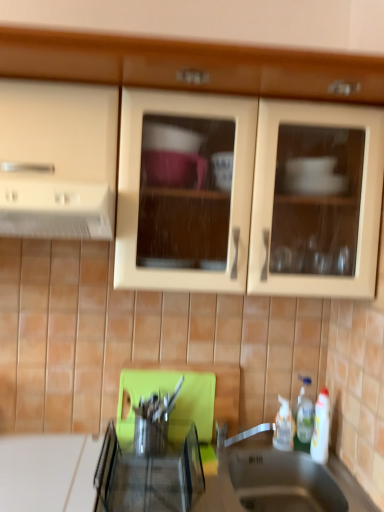
Locate an element on the screen. This screenshot has height=512, width=384. white matte exhaust hood at left is located at coordinates (54, 209).

The height and width of the screenshot is (512, 384). Describe the element at coordinates (54, 209) in the screenshot. I see `white matte exhaust hood at left` at that location.

Where is `metallic stainless steel sink at lower center`? This screenshot has width=384, height=512. metallic stainless steel sink at lower center is located at coordinates (283, 482).

In order to face metallic stainless steel knife block at center, should I rotate leftwards or rightwards?

It's best to rotate left around 5.247 degrees.

Locate an element on the screen. This screenshot has width=384, height=512. metallic stainless steel knife block at center is located at coordinates (148, 477).

Locate an element on the screen. Image resolution: width=384 pixels, height=512 pixels. white glossy bottle at lower right, the 1th bottle positioned from the right is located at coordinates (321, 428).

Identify the location of white matte exhaust hood at left. This screenshot has height=512, width=384. (54, 209).

Considering their positions, is white plastic bottle at lower right, acting as the 1th bottle starting from the left, located in front of or behind metallic stainless steel sink at lower center?

Clearly, white plastic bottle at lower right, acting as the 1th bottle starting from the left, is behind metallic stainless steel sink at lower center.

Would you say white plastic bottle at lower right, acting as the 2th bottle starting from the right, is inside or outside metallic stainless steel sink at lower center?

white plastic bottle at lower right, acting as the 2th bottle starting from the right, exists outside the volume of metallic stainless steel sink at lower center.

Considering the positions of objects white plastic bottle at lower right, acting as the 1th bottle starting from the left, and metallic stainless steel sink at lower center in the image provided, who is more to the right, white plastic bottle at lower right, acting as the 1th bottle starting from the left, or metallic stainless steel sink at lower center?

From the viewer's perspective, white plastic bottle at lower right, acting as the 1th bottle starting from the left, appears more on the right side.

Looking at this image, considering the sizes of objects white plastic bottle at lower right, acting as the 2th bottle starting from the right, and metallic stainless steel sink at lower center in the image provided, who is smaller, white plastic bottle at lower right, acting as the 2th bottle starting from the right, or metallic stainless steel sink at lower center?

With smaller size is white plastic bottle at lower right, acting as the 2th bottle starting from the right.

Does point (3, 230) come closer to viewer compared to point (146, 511)?

No, (3, 230) is further to viewer.

Which of these two, white matte exhaust hood at left or metallic stainless steel knife block at center, is smaller?

Smaller between the two is metallic stainless steel knife block at center.

Is white matte exhaust hood at left wider than metallic stainless steel knife block at center?

Indeed, white matte exhaust hood at left has a greater width compared to metallic stainless steel knife block at center.

Does white matte exhaust hood at left have a greater height compared to metallic stainless steel knife block at center?

Yes, white matte exhaust hood at left is taller than metallic stainless steel knife block at center.

Does white glossy bottle at lower right, the 1th bottle positioned from the right, appear on the right side of matte wood cabinets at upper center?

Correct, you'll find white glossy bottle at lower right, the 1th bottle positioned from the right, to the right of matte wood cabinets at upper center.

From the image's perspective, would you say white glossy bottle at lower right, which is the 2th bottle from left to right, is shown under matte wood cabinets at upper center?

Yes, from the image's perspective, white glossy bottle at lower right, which is the 2th bottle from left to right, is below matte wood cabinets at upper center.

Is white glossy bottle at lower right, the 1th bottle positioned from the right, turned away from matte wood cabinets at upper center?

white glossy bottle at lower right, the 1th bottle positioned from the right, does not have its back to matte wood cabinets at upper center.

Which of these two, white plastic bottle at lower right, acting as the 2th bottle starting from the right, or white glossy bottle at lower right, which is the 2th bottle from left to right, stands shorter?

Standing shorter between the two is white plastic bottle at lower right, acting as the 2th bottle starting from the right.

Considering the positions of objects white plastic bottle at lower right, acting as the 2th bottle starting from the right, and white glossy bottle at lower right, which is the 2th bottle from left to right, in the image provided, who is more to the left, white plastic bottle at lower right, acting as the 2th bottle starting from the right, or white glossy bottle at lower right, which is the 2th bottle from left to right,?

Positioned to the left is white plastic bottle at lower right, acting as the 2th bottle starting from the right.

Is white plastic bottle at lower right, acting as the 2th bottle starting from the right, spatially inside white glossy bottle at lower right, the 1th bottle positioned from the right, or outside of it?

white plastic bottle at lower right, acting as the 2th bottle starting from the right, cannot be found inside white glossy bottle at lower right, the 1th bottle positioned from the right.

Is white plastic bottle at lower right, acting as the 1th bottle starting from the left, positioned far away from white glossy bottle at lower right, which is the 2th bottle from left to right?

No.

Are matte wood cabinets at upper center and white glossy bottle at lower right, the 1th bottle positioned from the right, beside each other?

No, matte wood cabinets at upper center is not beside white glossy bottle at lower right, the 1th bottle positioned from the right.

From the image's perspective, which object appears higher, matte wood cabinets at upper center or white glossy bottle at lower right, the 1th bottle positioned from the right?

matte wood cabinets at upper center appears higher in the image.

Considering the sizes of matte wood cabinets at upper center and white glossy bottle at lower right, which is the 2th bottle from left to right, in the image, is matte wood cabinets at upper center taller or shorter than white glossy bottle at lower right, which is the 2th bottle from left to right,?

matte wood cabinets at upper center is taller than white glossy bottle at lower right, which is the 2th bottle from left to right.

Which object is wider, white glossy bottle at lower right, which is the 2th bottle from left to right, or white matte exhaust hood at left?

white matte exhaust hood at left.

Is white glossy bottle at lower right, the 1th bottle positioned from the right, bigger than white matte exhaust hood at left?

No, white glossy bottle at lower right, the 1th bottle positioned from the right, is not bigger than white matte exhaust hood at left.

Looking at this image, is white glossy bottle at lower right, the 1th bottle positioned from the right, situated inside white matte exhaust hood at left or outside?

white glossy bottle at lower right, the 1th bottle positioned from the right, exists outside the volume of white matte exhaust hood at left.

Who is taller, white glossy bottle at lower right, the 1th bottle positioned from the right, or white matte exhaust hood at left?

With more height is white glossy bottle at lower right, the 1th bottle positioned from the right.

Would you say matte wood cabinets at upper center contains white plastic bottle at lower right, acting as the 1th bottle starting from the left?

No.

Does matte wood cabinets at upper center come behind white plastic bottle at lower right, acting as the 2th bottle starting from the right?

No, it is not.

Considering the sizes of objects matte wood cabinets at upper center and white plastic bottle at lower right, acting as the 2th bottle starting from the right, in the image provided, who is thinner, matte wood cabinets at upper center or white plastic bottle at lower right, acting as the 2th bottle starting from the right,?

Thinner between the two is white plastic bottle at lower right, acting as the 2th bottle starting from the right.

Which is more to the right, matte wood cabinets at upper center or white plastic bottle at lower right, acting as the 1th bottle starting from the left?

white plastic bottle at lower right, acting as the 1th bottle starting from the left, is more to the right.

Locate an element on the screen. the 1st bottle above the metallic stainless steel sink at lower center (from a real-world perspective) is located at coordinates (284, 426).

Locate an element on the screen. The image size is (384, 512). appliance located behind the white matte exhaust hood at left is located at coordinates (148, 477).

Looking at this image, estimate the real-world distances between objects in this image. Which object is closer to white matte exhaust hood at left, white glossy bottle at lower right, the 1th bottle positioned from the right, or metallic stainless steel sink at lower center?

Among the two, metallic stainless steel sink at lower center is located nearer to white matte exhaust hood at left.

Estimate the real-world distances between objects in this image. Which object is closer to white glossy bottle at lower right, which is the 2th bottle from left to right, matte wood cabinets at upper center or metallic stainless steel sink at lower center?

Based on the image, metallic stainless steel sink at lower center appears to be nearer to white glossy bottle at lower right, which is the 2th bottle from left to right.

When comparing their distances from metallic stainless steel knife block at center, does matte wood cabinets at upper center or metallic stainless steel sink at lower center seem closer?

metallic stainless steel sink at lower center is closer to metallic stainless steel knife block at center.

Which object lies nearer to the anchor point white matte exhaust hood at left, matte wood cabinets at upper center or metallic stainless steel knife block at center?

Based on the image, matte wood cabinets at upper center appears to be nearer to white matte exhaust hood at left.

From the image, which object appears to be farther from metallic stainless steel knife block at center, metallic stainless steel sink at lower center or white plastic bottle at lower right, acting as the 2th bottle starting from the right?

Among the two, white plastic bottle at lower right, acting as the 2th bottle starting from the right, is located further to metallic stainless steel knife block at center.

When comparing their distances from white glossy bottle at lower right, the 1th bottle positioned from the right, does white matte exhaust hood at left or metallic stainless steel knife block at center seem closer?

Among the two, metallic stainless steel knife block at center is located nearer to white glossy bottle at lower right, the 1th bottle positioned from the right.

Based on their spatial positions, is white glossy bottle at lower right, the 1th bottle positioned from the right, or white plastic bottle at lower right, acting as the 1th bottle starting from the left, closer to white matte exhaust hood at left?

white plastic bottle at lower right, acting as the 1th bottle starting from the left, lies closer to white matte exhaust hood at left than the other object.

Considering their positions, is metallic stainless steel sink at lower center positioned further to white plastic bottle at lower right, acting as the 1th bottle starting from the left, than white matte exhaust hood at left?

The object further to white plastic bottle at lower right, acting as the 1th bottle starting from the left, is white matte exhaust hood at left.

The width and height of the screenshot is (384, 512). Find the location of `cabinetry between white matte exhaust hood at left and white glossy bottle at lower right, which is the 2th bottle from left to right`. cabinetry between white matte exhaust hood at left and white glossy bottle at lower right, which is the 2th bottle from left to right is located at coordinates (190, 66).

You are a GUI agent. You are given a task and a screenshot of the screen. Output one action in this format:
    pyautogui.click(x=<x>, y=<y>)
    Task: Click on the sink between metallic stainless steel knife block at center and white plastic bottle at lower right, acting as the 1th bottle starting from the left
    The width and height of the screenshot is (384, 512).
    Given the screenshot: What is the action you would take?
    pyautogui.click(x=283, y=482)

This screenshot has height=512, width=384. Find the location of `bottle located between metallic stainless steel knife block at center and white glossy bottle at lower right, the 1th bottle positioned from the right, in the left-right direction`. bottle located between metallic stainless steel knife block at center and white glossy bottle at lower right, the 1th bottle positioned from the right, in the left-right direction is located at coordinates (284, 426).

Where is `appliance between white matte exhaust hood at left and white glossy bottle at lower right, which is the 2th bottle from left to right, in the horizontal direction`? The width and height of the screenshot is (384, 512). appliance between white matte exhaust hood at left and white glossy bottle at lower right, which is the 2th bottle from left to right, in the horizontal direction is located at coordinates (148, 477).